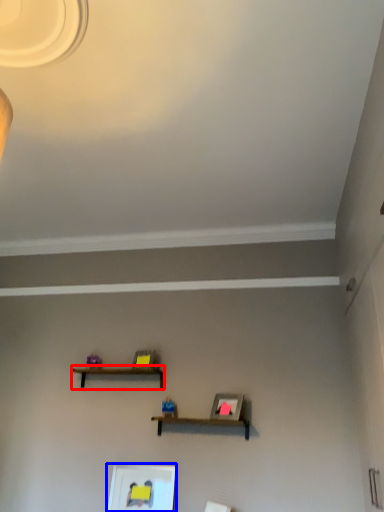
Question: Which object appears closest to the camera in this image, shelf (highlighted by a red box) or picture frame (highlighted by a blue box)?

Choices:
 (A) shelf
 (B) picture frame

Answer: (B)